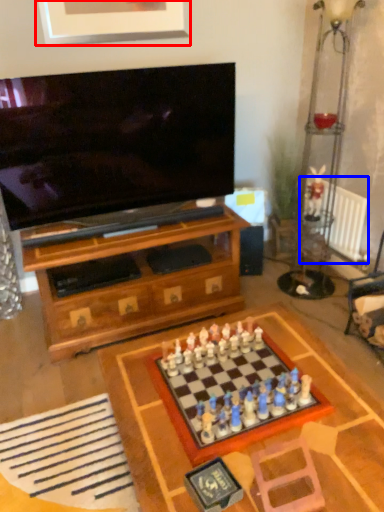
Question: Which object appears farthest to the camera in this image, picture frame (highlighted by a red box) or radiator (highlighted by a blue box)?

Choices:
 (A) picture frame
 (B) radiator

Answer: (B)